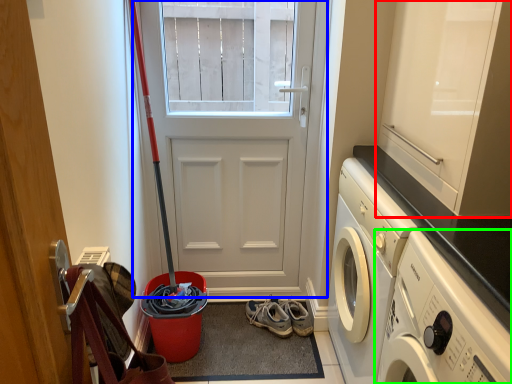
Question: Considering the real-world distances, which object is closest to cabinetry (highlighted by a red box)? door (highlighted by a blue box) or washing machine (highlighted by a green box).

Choices:
 (A) door
 (B) washing machine

Answer: (B)